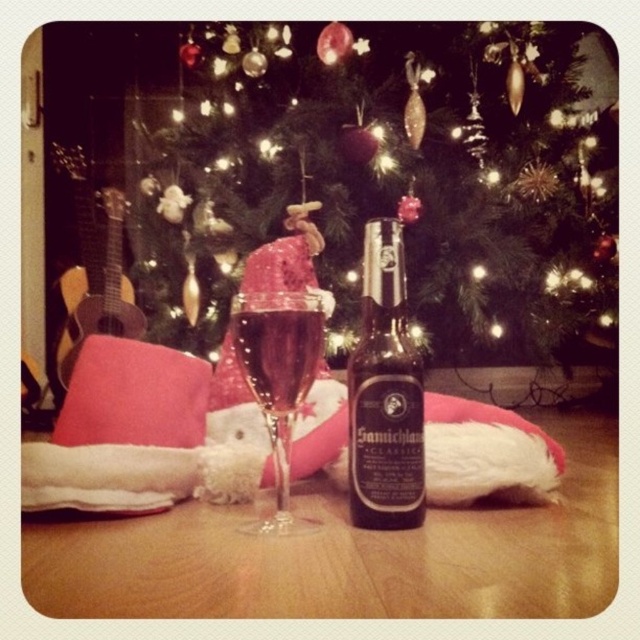
Question: Which point is closer to the camera?

Choices:
 (A) transparent glass at center
 (B) translucent glass at center

Answer: (A)

Question: Which object is closer to the camera taking this photo?

Choices:
 (A) transparent glass at center
 (B) green matte christmas tree at center
 (C) translucent glass at center
 (D) black matte bottle at center

Answer: (A)

Question: Which of the following is the farthest from the observer?

Choices:
 (A) translucent glass at center
 (B) transparent glass at center
 (C) black matte bottle at center
 (D) green matte christmas tree at center

Answer: (D)

Question: Is black matte bottle at center wider than transparent glass at center?

Choices:
 (A) no
 (B) yes

Answer: (A)

Question: Can you confirm if green matte christmas tree at center is positioned above transparent glass at center?

Choices:
 (A) no
 (B) yes

Answer: (B)

Question: Is green matte christmas tree at center wider than translucent glass at center?

Choices:
 (A) yes
 (B) no

Answer: (A)